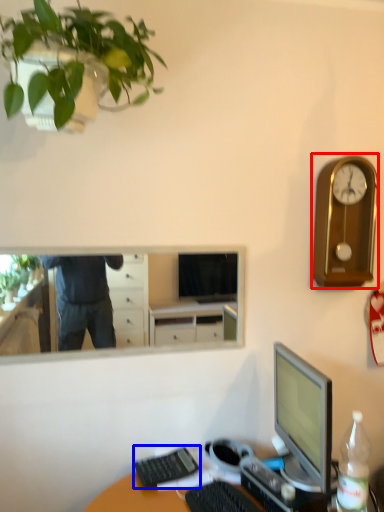
Question: Which point is further to the camera, clock (highlighted by a red box) or computer keyboard (highlighted by a blue box)?

Choices:
 (A) clock
 (B) computer keyboard

Answer: (A)